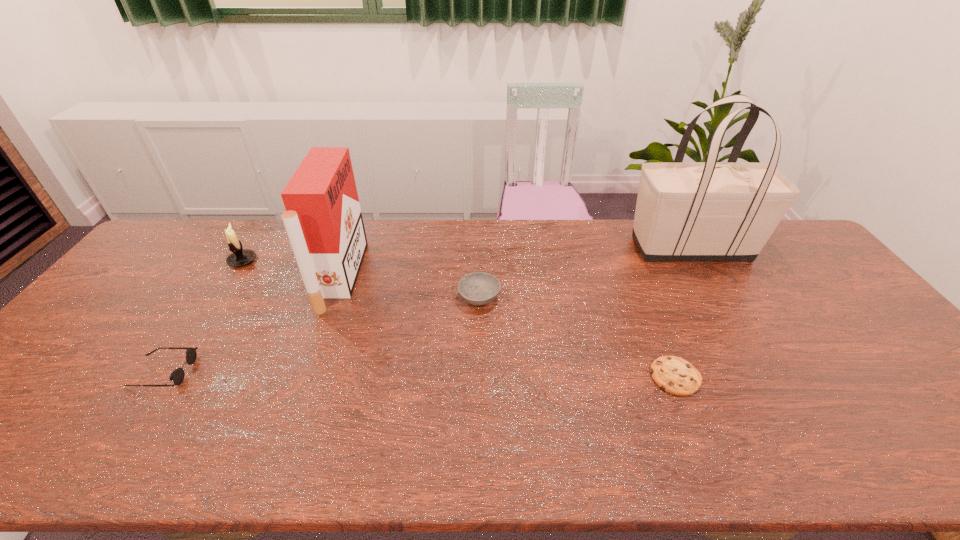
What are the coordinates of `vacant space situated 0.360m on the front-facing side of the third object from left to right` in the screenshot? It's located at (475, 276).

Where is `vacant space located 0.050m on the back of the candle holder`? The height and width of the screenshot is (540, 960). vacant space located 0.050m on the back of the candle holder is located at coordinates (253, 243).

Locate an element on the screen. Image resolution: width=960 pixels, height=540 pixels. vacant position located on the right of the bowl is located at coordinates (569, 298).

This screenshot has height=540, width=960. What are the coordinates of `vacant space located on the front-facing side of the second shortest object` in the screenshot? It's located at (328, 372).

Identify the location of vacant point located 0.070m on the right of the shortest object. (729, 376).

At what (x,y) coordinates should I click in order to perform the action: click on shopping bag that is at the far edge. Please return your answer as a coordinate pair (x, y). The height and width of the screenshot is (540, 960). Looking at the image, I should click on (693, 211).

This screenshot has width=960, height=540. What are the coordinates of `cigarette case that is at the far edge` in the screenshot? It's located at (323, 219).

At what (x,y) coordinates should I click in order to perform the action: click on candle holder situated at the far edge. Please return your answer as a coordinate pair (x, y). Looking at the image, I should click on (240, 257).

This screenshot has width=960, height=540. In the image, there is a desktop. In order to click on free space at the far edge in this screenshot , I will do `click(500, 248)`.

At what (x,y) coordinates should I click in order to perform the action: click on free space at the near edge of the desktop. Please return your answer as a coordinate pair (x, y). Looking at the image, I should click on (367, 468).